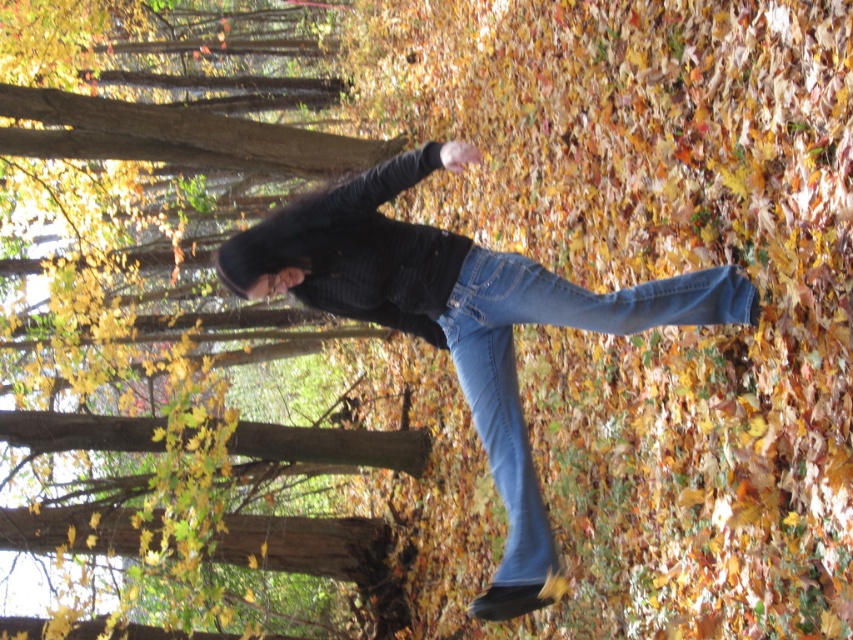
Question: Is brown wood tree at center behind denim jeans at center?

Choices:
 (A) no
 (B) yes

Answer: (B)

Question: Considering the real-world distances, which object is closest to the brown wood tree at center?

Choices:
 (A) denim at center
 (B) denim jeans at center

Answer: (B)

Question: Which point is farther to the camera?

Choices:
 (A) denim at center
 (B) denim jeans at center
 (C) brown wood tree at center

Answer: (C)

Question: Is denim jeans at center in front of denim at center?

Choices:
 (A) yes
 (B) no

Answer: (A)

Question: Which of the following is the farthest from the observer?

Choices:
 (A) denim at center
 (B) denim jeans at center

Answer: (A)

Question: Is brown wood tree at center below denim jeans at center?

Choices:
 (A) yes
 (B) no

Answer: (B)